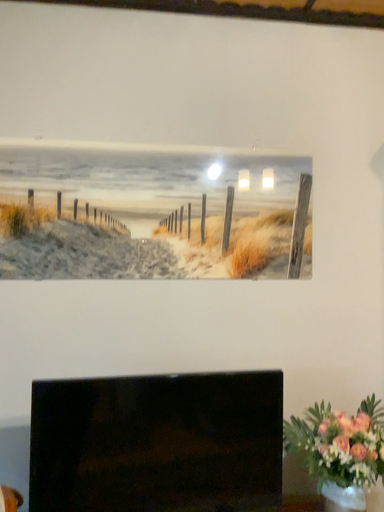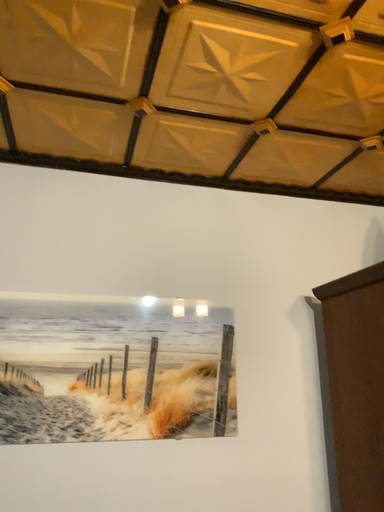
Question: How did the camera likely rotate when shooting the video?

Choices:
 (A) rotated downward
 (B) rotated upward

Answer: (B)